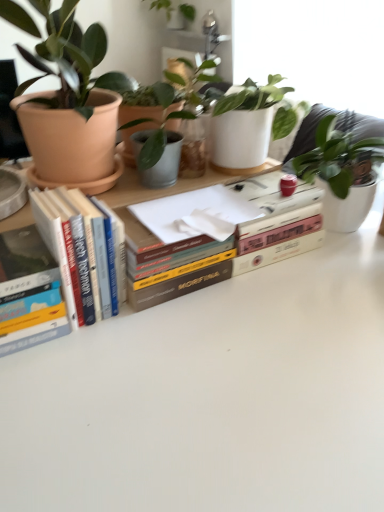
Question: Is matte terracotta pot at upper left, which is the first houseplant in bottom-to-top order, at the left side of hardcover books at left, the 2th book from the right?

Choices:
 (A) yes
 (B) no

Answer: (B)

Question: From a real-world perspective, is matte terracotta pot at upper left, arranged as the 3th houseplant when viewed from the top, under hardcover books at left, the 2th book from the right?

Choices:
 (A) no
 (B) yes

Answer: (A)

Question: Does matte terracotta pot at upper left, which is counted as the 2th houseplant, starting from the back, touch hardcover books at left, acting as the second book starting from the left?

Choices:
 (A) no
 (B) yes

Answer: (A)

Question: Does matte terracotta pot at upper left, which is the 2th houseplant from front to back, appear on the right side of hardcover books at left, acting as the second book starting from the left?

Choices:
 (A) yes
 (B) no

Answer: (A)

Question: Is matte terracotta pot at upper left, which is the 2th houseplant from front to back, not near hardcover books at left, the 2th book from the right?

Choices:
 (A) no
 (B) yes

Answer: (A)

Question: Is matte terracotta pot at upper left, arranged as the 3th houseplant when viewed from the top, facing away from hardcover books at left, acting as the second book starting from the left?

Choices:
 (A) no
 (B) yes

Answer: (B)

Question: Is matte terracotta pot at left, the second houseplant in the top-to-bottom sequence, not close to matte terracotta pot at upper left, arranged as the 3th houseplant when viewed from the top?

Choices:
 (A) no
 (B) yes

Answer: (A)

Question: Considering the relative positions of matte terracotta pot at left, the second houseplant positioned from the bottom, and matte terracotta pot at upper left, arranged as the 3th houseplant when viewed from the top, in the image provided, is matte terracotta pot at left, the second houseplant positioned from the bottom, to the left of matte terracotta pot at upper left, arranged as the 3th houseplant when viewed from the top, from the viewer's perspective?

Choices:
 (A) yes
 (B) no

Answer: (A)

Question: Can we say matte terracotta pot at left, positioned as the 3th houseplant in back-to-front order, lies outside matte terracotta pot at upper left, which is the 2th houseplant from front to back?

Choices:
 (A) no
 (B) yes

Answer: (B)

Question: Is matte terracotta pot at left, positioned as the 3th houseplant in back-to-front order, to the right of matte terracotta pot at upper left, arranged as the 3th houseplant when viewed from the top, from the viewer's perspective?

Choices:
 (A) no
 (B) yes

Answer: (A)

Question: Is matte terracotta pot at left, the second houseplant positioned from the bottom, touching matte terracotta pot at upper left, which is counted as the 2th houseplant, starting from the back?

Choices:
 (A) yes
 (B) no

Answer: (B)

Question: Does matte terracotta pot at left, the second houseplant in the top-to-bottom sequence, have a lesser height compared to matte terracotta pot at upper left, which is the first houseplant in bottom-to-top order?

Choices:
 (A) no
 (B) yes

Answer: (A)

Question: Is hardcover book at center, marked as the 1th book in a right-to-left arrangement, at the back of hardcover books at left, acting as the second book starting from the left?

Choices:
 (A) yes
 (B) no

Answer: (B)